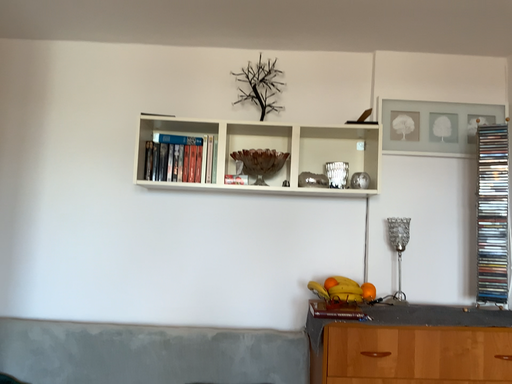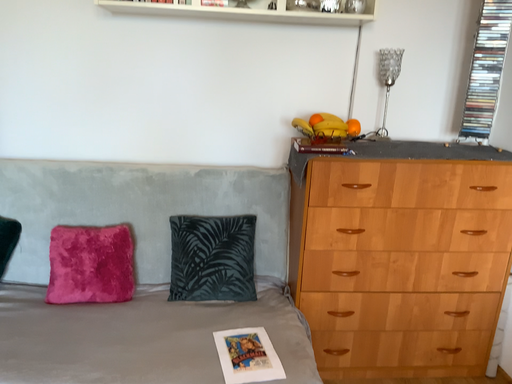
Question: How did the camera likely rotate when shooting the video?

Choices:
 (A) rotated upward
 (B) rotated downward

Answer: (B)